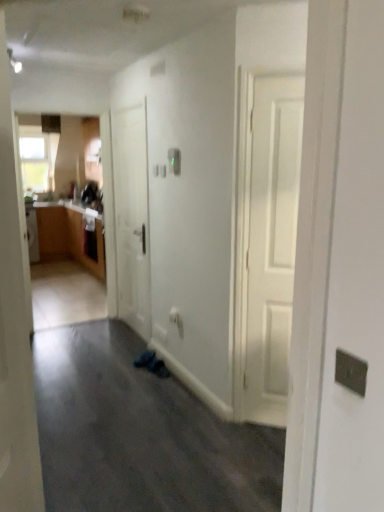
What do you see at coordinates (131, 216) in the screenshot? The image size is (384, 512). I see `white matte door at center, the 2th door positioned from the right` at bounding box center [131, 216].

The image size is (384, 512). Describe the element at coordinates (140, 434) in the screenshot. I see `dark gray carpet at lower center` at that location.

Where is `white matte door at center, acting as the first door starting from the left`? white matte door at center, acting as the first door starting from the left is located at coordinates (131, 216).

Between white matte door at center, the 2th door in the front-to-back sequence, and dark gray carpet at lower center, which one has smaller size?

Smaller between the two is dark gray carpet at lower center.

Is white matte door at center, acting as the 1th door starting from the back, touching dark gray carpet at lower center?

No, white matte door at center, acting as the 1th door starting from the back, is not next to dark gray carpet at lower center.

From the image's perspective, who appears lower, white matte door at center, acting as the 1th door starting from the back, or dark gray carpet at lower center?

dark gray carpet at lower center appears lower in the image.

This screenshot has height=512, width=384. Find the location of `plain in front of the white matte door at center, acting as the 1th door starting from the back`. plain in front of the white matte door at center, acting as the 1th door starting from the back is located at coordinates (140, 434).

How distant is dark gray carpet at lower center from clear glass window at upper left?

They are 4.37 meters apart.

Is dark gray carpet at lower center shorter than clear glass window at upper left?

Correct, dark gray carpet at lower center is not as tall as clear glass window at upper left.

From the picture: Is dark gray carpet at lower center bigger or smaller than clear glass window at upper left?

Considering their sizes, dark gray carpet at lower center takes up more space than clear glass window at upper left.

Is dark gray carpet at lower center looking in the opposite direction of clear glass window at upper left?

dark gray carpet at lower center is not turned away from clear glass window at upper left.

Based on their positions, is white matte door at left, which is counted as the first door, starting from the right, located to the left or right of dark gray carpet at lower center?

Based on their positions, white matte door at left, which is counted as the first door, starting from the right, is located to the right of dark gray carpet at lower center.

Between point (14, 338) and point (216, 430), which one is positioned behind?

The point (216, 430) is farther.

Looking at this image, is white matte door at left, which appears as the second door when viewed from the left, taller than dark gray carpet at lower center?

Indeed, white matte door at left, which appears as the second door when viewed from the left, has a greater height compared to dark gray carpet at lower center.

From a real-world perspective, which object rests below the other?

dark gray carpet at lower center, from a real-world perspective.

Is clear glass window at upper left directly adjacent to white matte door at left, which is the first door from front to back?

No, clear glass window at upper left is not beside white matte door at left, which is the first door from front to back.

Is clear glass window at upper left wider or thinner than white matte door at left, which is counted as the first door, starting from the right?

Clearly, clear glass window at upper left has less width compared to white matte door at left, which is counted as the first door, starting from the right.

Is clear glass window at upper left to the left of white matte door at left, which appears as the second door when viewed from the left, from the viewer's perspective?

Correct, you'll find clear glass window at upper left to the left of white matte door at left, which appears as the second door when viewed from the left.

From a real-world perspective, is clear glass window at upper left beneath white matte door at left, which appears as the second door when viewed from the left?

No, from a real-world perspective, clear glass window at upper left is not beneath white matte door at left, which appears as the second door when viewed from the left.

From the image's perspective, relative to white matte door at center, acting as the first door starting from the left, is white matte door at left, which appears as the second door when viewed from the left, above or below?

white matte door at left, which appears as the second door when viewed from the left, is situated lower than white matte door at center, acting as the first door starting from the left, in the image.

Does white matte door at left, the 2th door from the back, have a smaller size compared to white matte door at center, acting as the 1th door starting from the back?

Yes.

Is white matte door at left, the 2th door from the back, outside of white matte door at center, the 2th door in the front-to-back sequence?

white matte door at left, the 2th door from the back, lies outside white matte door at center, the 2th door in the front-to-back sequence,'s area.

Is white matte door at left, which is counted as the first door, starting from the right, beside white matte door at center, acting as the first door starting from the left?

No, white matte door at left, which is counted as the first door, starting from the right, is not touching white matte door at center, acting as the first door starting from the left.

Is the surface of white matte door at center, the 2th door positioned from the right, in direct contact with white matte door at left, which is the first door from front to back?

No, white matte door at center, the 2th door positioned from the right, is not making contact with white matte door at left, which is the first door from front to back.

Where is `door to the right of white matte door at center, acting as the first door starting from the left`? door to the right of white matte door at center, acting as the first door starting from the left is located at coordinates (15, 325).

Would you say white matte door at center, acting as the first door starting from the left, contains white matte door at left, which appears as the second door when viewed from the left?

No.

Considering the points (144, 210) and (23, 280), which point is in front, point (144, 210) or point (23, 280)?

Positioned in front is point (23, 280).

Does point (25, 153) come behind point (95, 382)?

Yes, it is behind point (95, 382).

Based on their sizes in the image, would you say clear glass window at upper left is bigger or smaller than dark gray carpet at lower center?

Considering their sizes, clear glass window at upper left takes up less space than dark gray carpet at lower center.

How many degrees apart are the facing directions of clear glass window at upper left and dark gray carpet at lower center?

There is a 180-degree angle between the facing directions of clear glass window at upper left and dark gray carpet at lower center.

Considering the sizes of objects clear glass window at upper left and dark gray carpet at lower center in the image provided, who is shorter, clear glass window at upper left or dark gray carpet at lower center?

dark gray carpet at lower center.

Image resolution: width=384 pixels, height=512 pixels. Identify the location of plain on the left of white matte door at center, acting as the 1th door starting from the back. (140, 434).

The image size is (384, 512). In the image, there is a clear glass window at upper left. What are the coordinates of `plain below it (from a real-world perspective)` in the screenshot? It's located at (140, 434).

Looking at the image, which one is located closer to white matte door at center, the 2th door in the front-to-back sequence, white matte door at left, which appears as the second door when viewed from the left, or clear glass window at upper left?

white matte door at left, which appears as the second door when viewed from the left, is closer to white matte door at center, the 2th door in the front-to-back sequence.

Considering their positions, is white matte door at left, which is counted as the first door, starting from the right, positioned closer to white matte door at center, the 2th door positioned from the right, than dark gray carpet at lower center?

The object closer to white matte door at center, the 2th door positioned from the right, is dark gray carpet at lower center.

Considering their positions, is dark gray carpet at lower center positioned closer to white matte door at center, the 2th door in the front-to-back sequence, than clear glass window at upper left?

Among the two, dark gray carpet at lower center is located nearer to white matte door at center, the 2th door in the front-to-back sequence.

Estimate the real-world distances between objects in this image. Which object is further from white matte door at left, which appears as the second door when viewed from the left, dark gray carpet at lower center or white matte door at center, acting as the first door starting from the left?

white matte door at center, acting as the first door starting from the left, is positioned further to the anchor white matte door at left, which appears as the second door when viewed from the left.

From the image, which object appears to be nearer to white matte door at left, the 2th door from the back, white matte door at center, acting as the 1th door starting from the back, or dark gray carpet at lower center?

dark gray carpet at lower center is positioned closer to the anchor white matte door at left, the 2th door from the back.

Consider the image. Considering their positions, is clear glass window at upper left positioned closer to dark gray carpet at lower center than white matte door at center, acting as the first door starting from the left?

white matte door at center, acting as the first door starting from the left, lies closer to dark gray carpet at lower center than the other object.

Looking at the image, which one is located closer to white matte door at left, the 2th door from the back, clear glass window at upper left or white matte door at center, the 2th door in the front-to-back sequence?

Among the two, white matte door at center, the 2th door in the front-to-back sequence, is located nearer to white matte door at left, the 2th door from the back.

From the image, which object appears to be nearer to dark gray carpet at lower center, white matte door at left, which is the first door from front to back, or white matte door at center, acting as the 1th door starting from the back?

white matte door at center, acting as the 1th door starting from the back, is positioned closer to the anchor dark gray carpet at lower center.

Where is `plain positioned between white matte door at left, which is counted as the first door, starting from the right, and white matte door at center, the 2th door in the front-to-back sequence, from near to far`? This screenshot has height=512, width=384. plain positioned between white matte door at left, which is counted as the first door, starting from the right, and white matte door at center, the 2th door in the front-to-back sequence, from near to far is located at coordinates (140, 434).

What are the coordinates of `door between white matte door at left, the 2th door from the back, and clear glass window at upper left, along the z-axis` in the screenshot? It's located at (131, 216).

Image resolution: width=384 pixels, height=512 pixels. What are the coordinates of `door between dark gray carpet at lower center and clear glass window at upper left in the front-back direction` in the screenshot? It's located at (131, 216).

Locate an element on the screen. plain located between white matte door at left, which is the first door from front to back, and clear glass window at upper left in the depth direction is located at coordinates (140, 434).